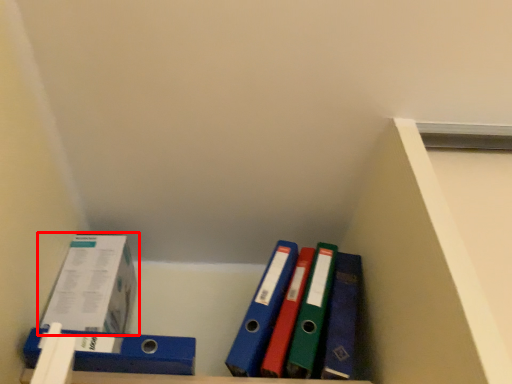
Question: Where is box (annotated by the red box) located in relation to binder in the image?

Choices:
 (A) left
 (B) right

Answer: (A)